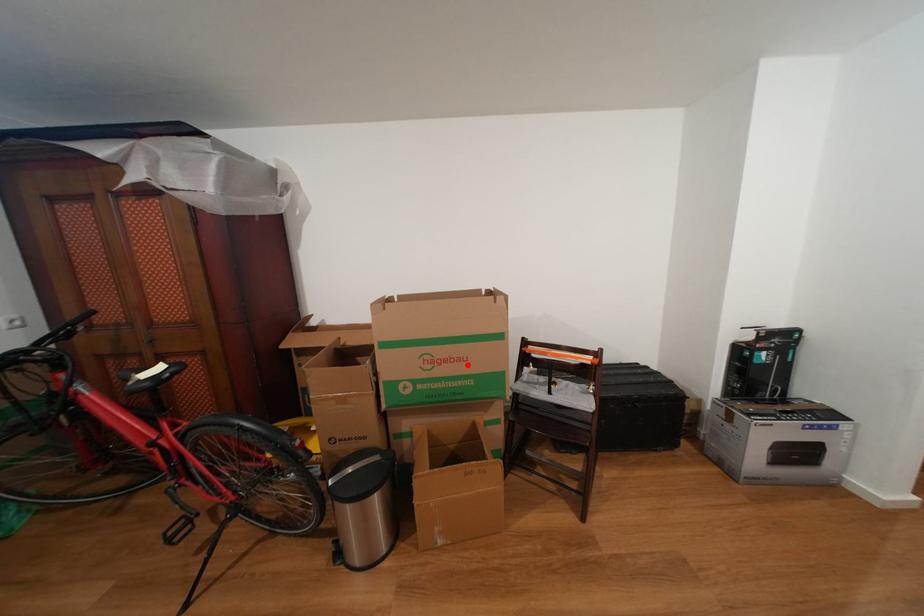
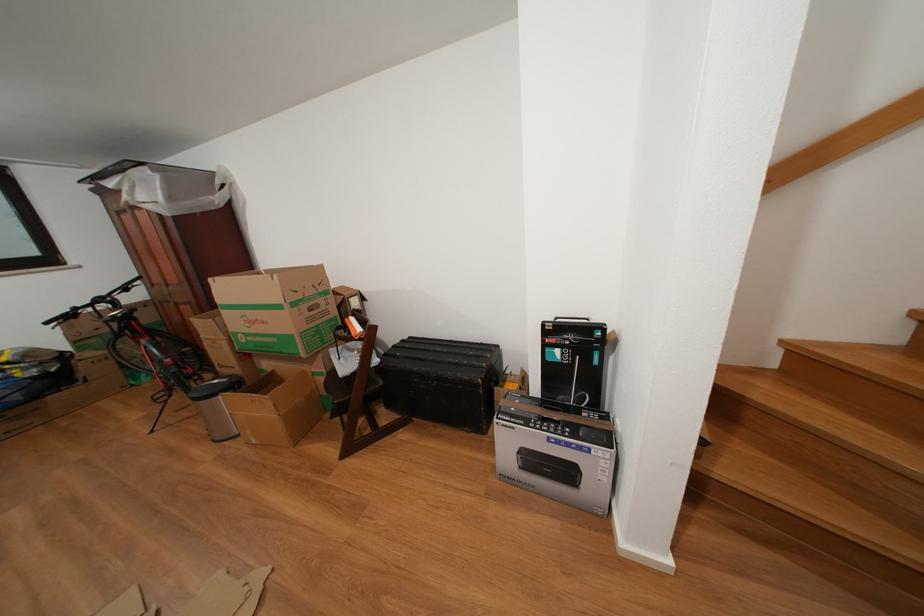
Locate, in the second image, the point that corresponds to the highlighted location in the first image.

(272, 328)